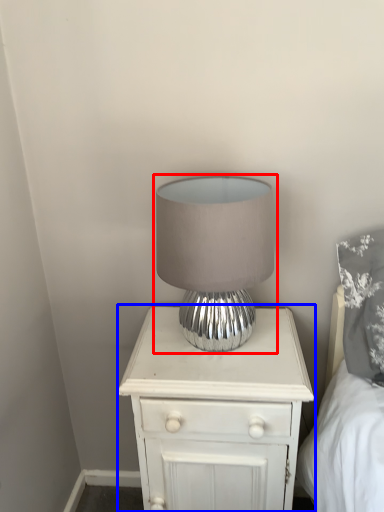
Question: Which object appears closest to the camera in this image, lamp (highlighted by a red box) or nightstand (highlighted by a blue box)?

Choices:
 (A) lamp
 (B) nightstand

Answer: (A)